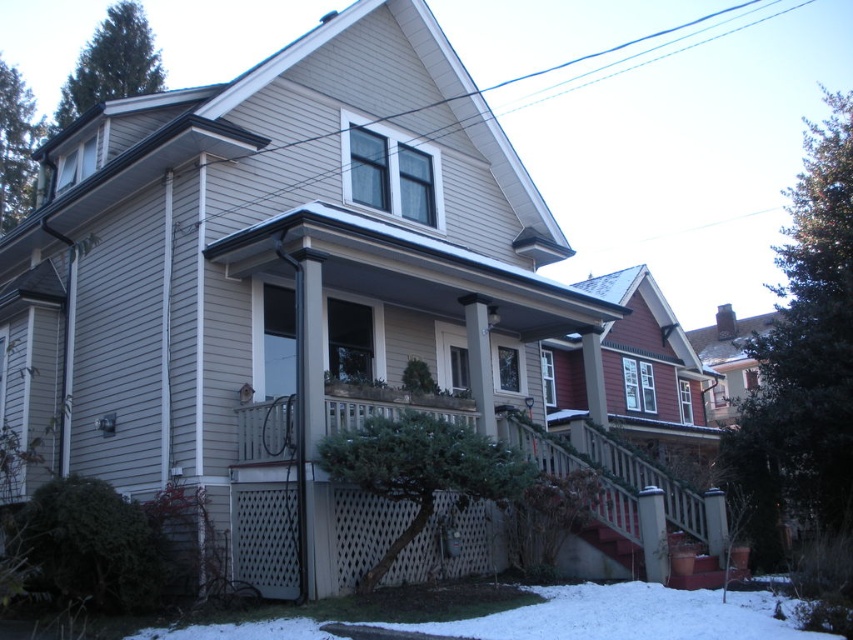
Question: Among these objects, which one is farthest from the camera?

Choices:
 (A) white powdery snow at lower center
 (B) white lattice porch at center

Answer: (B)

Question: Can you confirm if white lattice porch at center is bigger than white powdery snow at lower center?

Choices:
 (A) yes
 (B) no

Answer: (A)

Question: Does white lattice porch at center have a larger size compared to white powdery snow at lower center?

Choices:
 (A) yes
 (B) no

Answer: (A)

Question: Can you confirm if white lattice porch at center is positioned below white powdery snow at lower center?

Choices:
 (A) yes
 (B) no

Answer: (B)